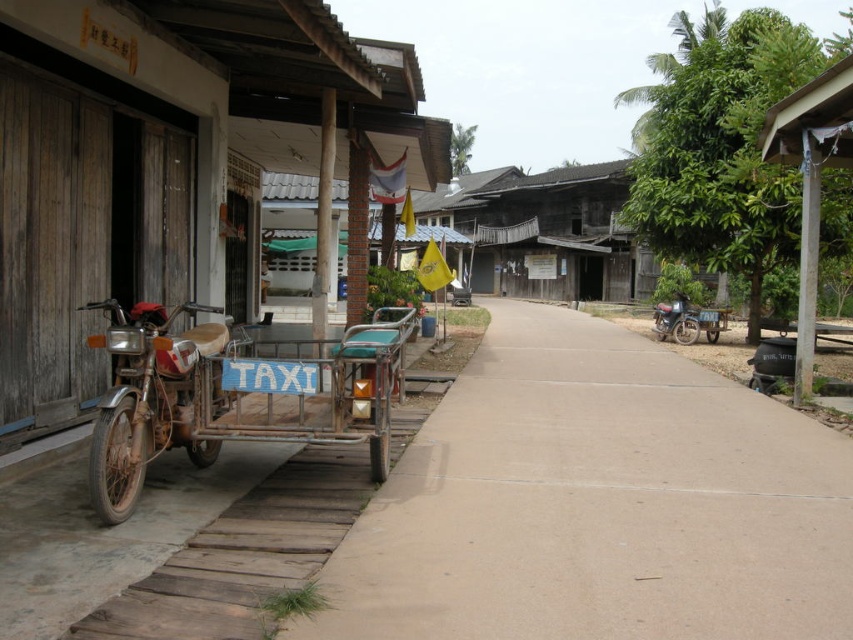
Who is more forward, (392,100) or (685,304)?

Positioned in front is point (392,100).

Describe the element at coordinates (167, 163) in the screenshot. This screenshot has height=640, width=853. I see `rusty metal tricycle at left` at that location.

You are a GUI agent. You are given a task and a screenshot of the screen. Output one action in this format:
    pyautogui.click(x=<x>, y=<y>)
    Task: Click on the rusty metal tricycle at left
    
    Given the screenshot: What is the action you would take?
    pyautogui.click(x=167, y=163)

What do you see at coordinates (167, 163) in the screenshot? The image size is (853, 640). I see `rusty metal tricycle at left` at bounding box center [167, 163].

Which of these two, rusty metal tricycle at left or rusty metal wagon at left, stands shorter?

rusty metal wagon at left

The image size is (853, 640). Find the location of `rusty metal tricycle at left`. rusty metal tricycle at left is located at coordinates (167, 163).

Identify the location of rusty metal tricycle at left. The width and height of the screenshot is (853, 640). (167, 163).

Which is in front, point (138, 378) or point (846, 88)?

Point (138, 378)

The image size is (853, 640). Describe the element at coordinates (233, 394) in the screenshot. I see `rusty metal wagon at left` at that location.

At what (x,y) coordinates should I click in order to perform the action: click on rusty metal wagon at left. Please return your answer as a coordinate pair (x, y). The image size is (853, 640). Looking at the image, I should click on (233, 394).